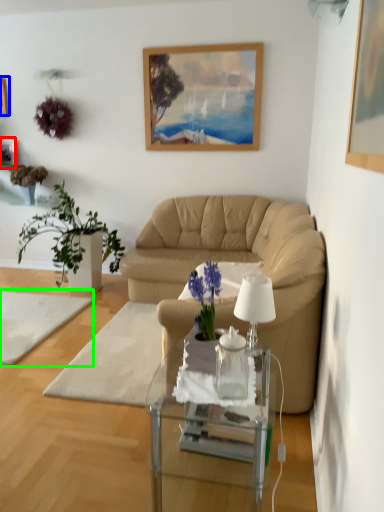
Question: Which object is the closest to the picture frame (highlighted by a red box)? Choose among these: picture frame (highlighted by a blue box) or plain (highlighted by a green box).

Choices:
 (A) picture frame
 (B) plain

Answer: (A)